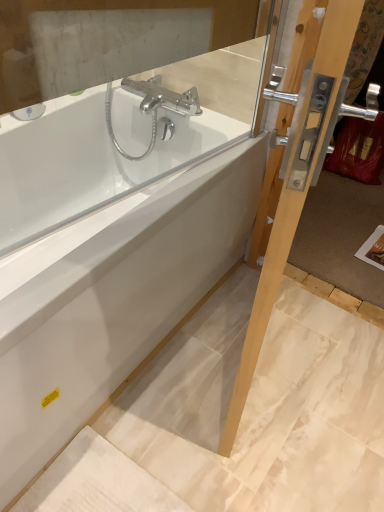
Identify the location of vacant space in front of clear glass screen door at right. This screenshot has width=384, height=512. (247, 443).